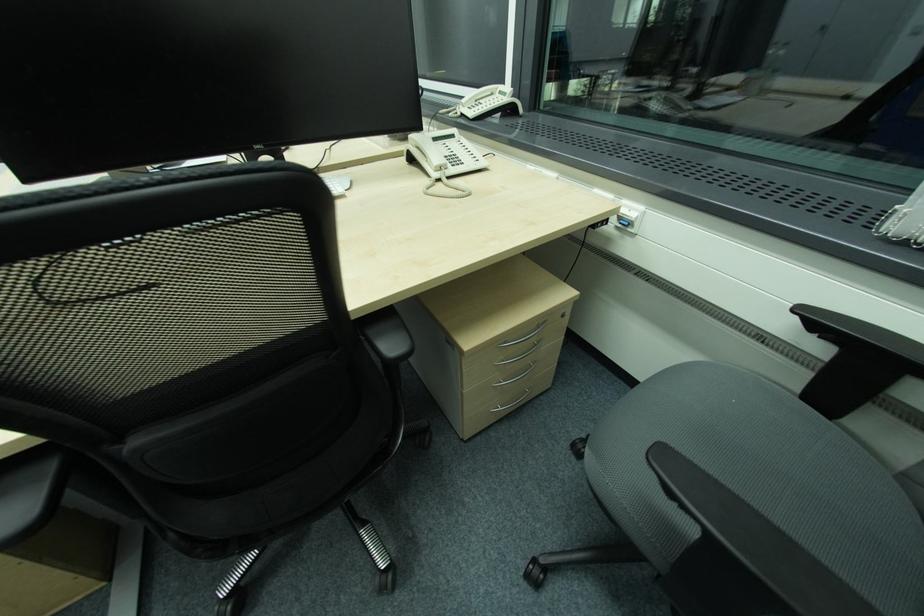
Describe the element at coordinates (532, 341) in the screenshot. I see `the drawer handle` at that location.